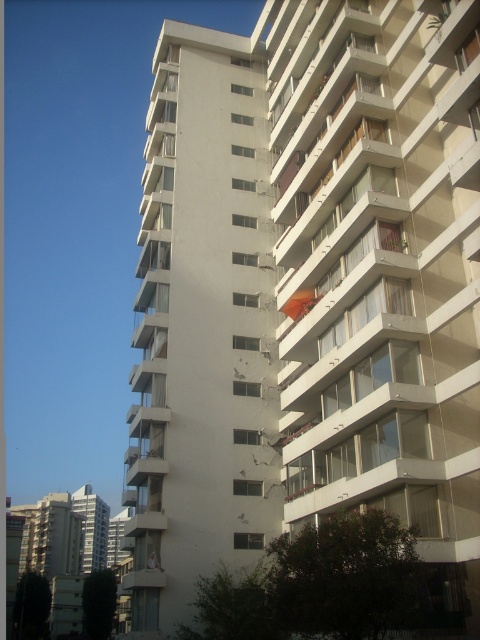
Question: Which of the following is the closest to the observer?

Choices:
 (A) orange fabric umbrella at center
 (B) white glossy balcony at center

Answer: (B)

Question: Is white glossy balcony at center to the left of orange fabric umbrella at center from the viewer's perspective?

Choices:
 (A) no
 (B) yes

Answer: (A)

Question: Among these points, which one is farthest from the camera?

Choices:
 (A) (312, 301)
 (B) (398, 81)

Answer: (A)

Question: Is white glossy balcony at center thinner than orange fabric umbrella at center?

Choices:
 (A) yes
 (B) no

Answer: (B)

Question: Which of the following is the farthest from the observer?

Choices:
 (A) (386, 218)
 (B) (297, 304)

Answer: (B)

Question: Does white glossy balcony at center have a lesser width compared to orange fabric umbrella at center?

Choices:
 (A) no
 (B) yes

Answer: (A)